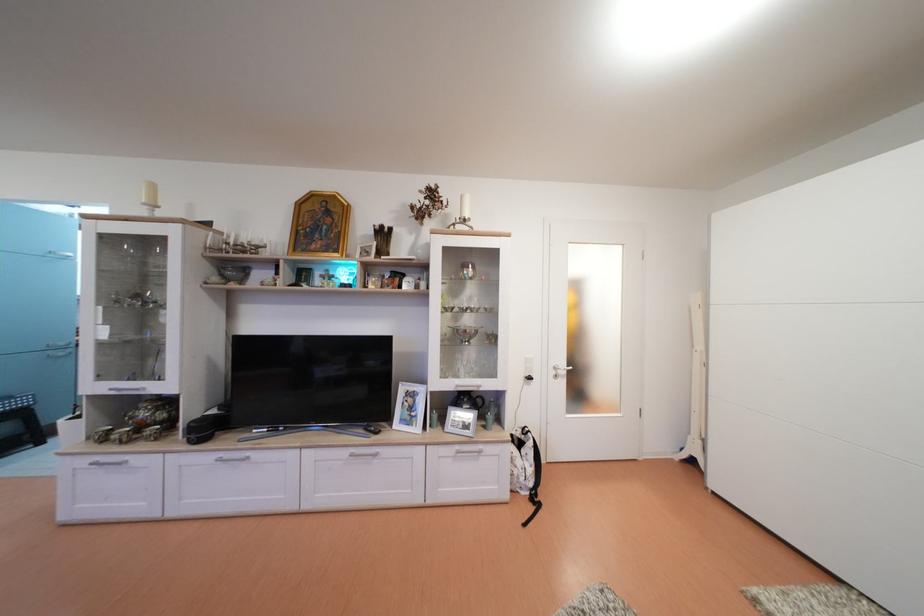
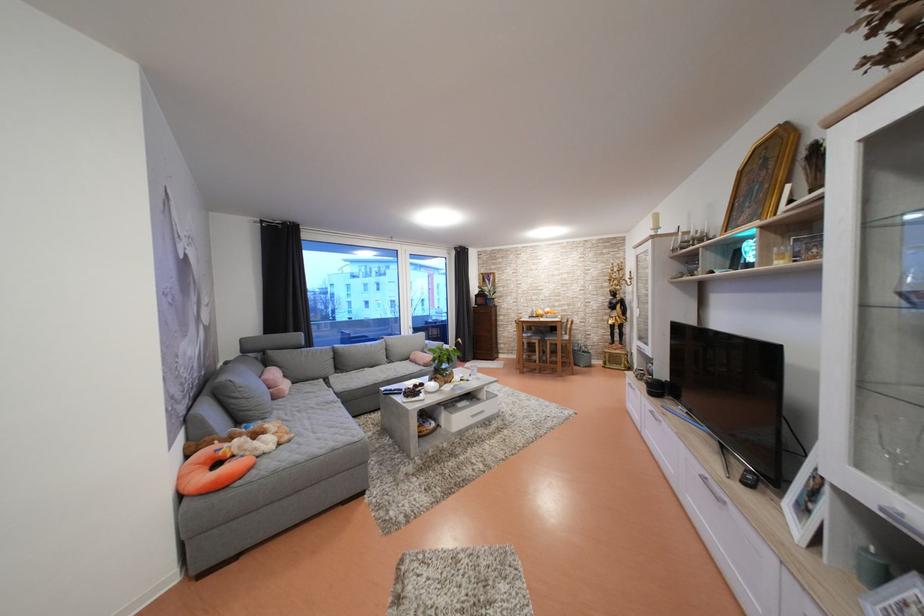
The point at (226,464) is marked in the first image. Where is the corresponding point in the second image?

(659, 416)